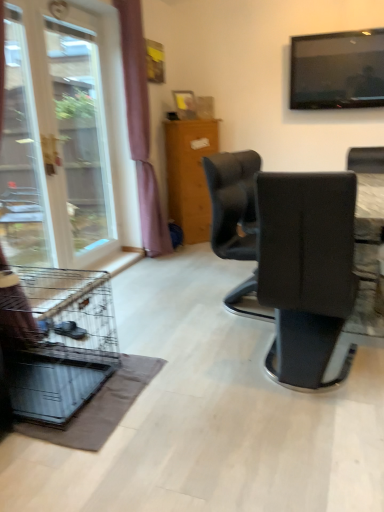
At what (x,y) coordinates should I click in order to perform the action: click on free space above transparent glass window at left (from a real-world perspective). Please return your answer as a coordinate pair (x, y). The width and height of the screenshot is (384, 512). Looking at the image, I should click on (72, 28).